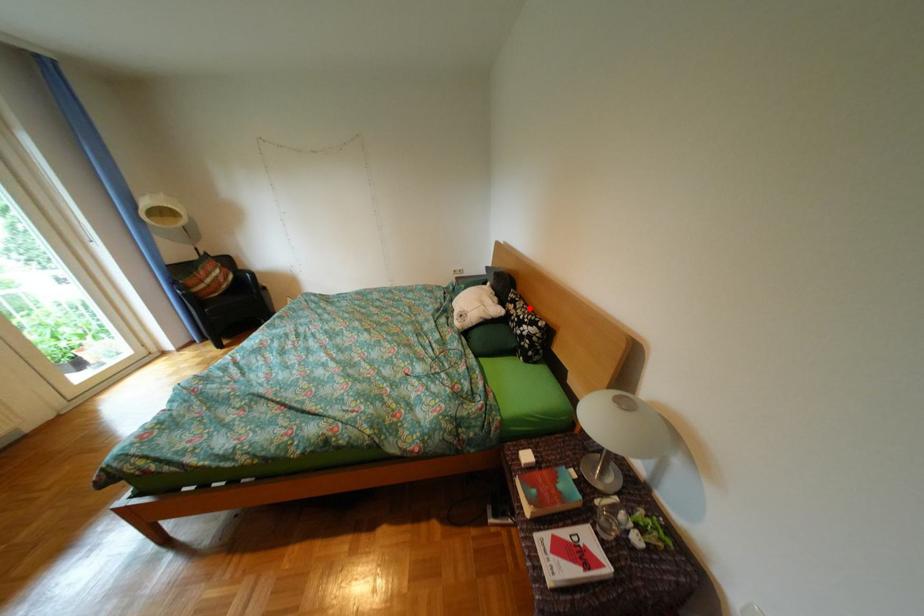
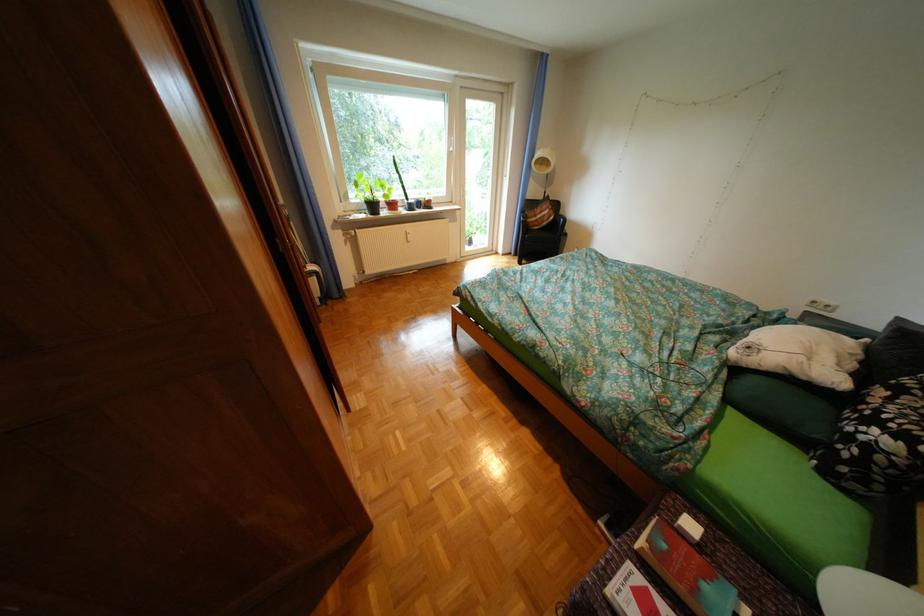
In the second image, find the point that corresponds to the highlighted location in the first image.

(904, 399)